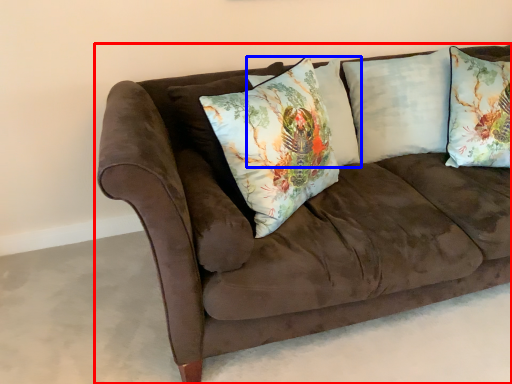
Question: Which object is further to the camera taking this photo, studio couch (highlighted by a red box) or pillow (highlighted by a blue box)?

Choices:
 (A) studio couch
 (B) pillow

Answer: (B)